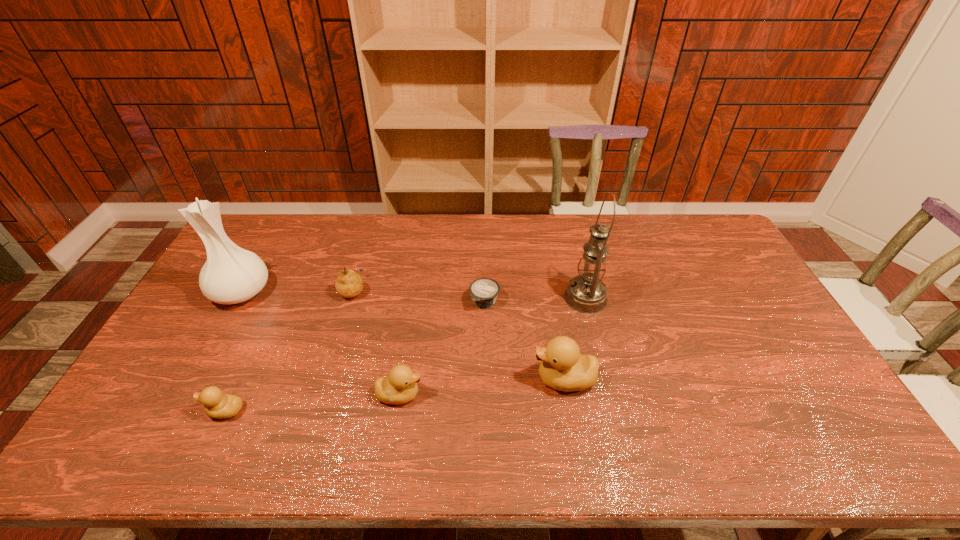
Please point a spot on the right to add another duckling. Please provide its 2D coordinates. Your answer should be formatted as a tuple, i.e. [(x, y)], where the tuple contains the x and y coordinates of a point satisfying the conditions above.

[(719, 364)]